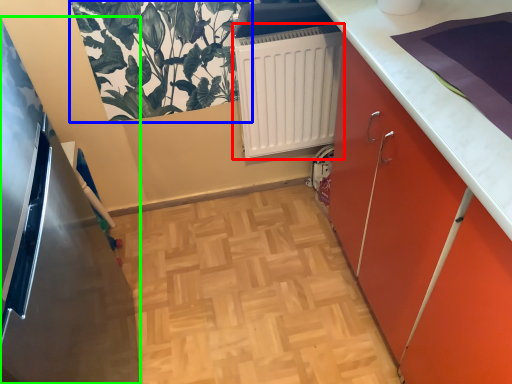
Question: Considering the real-world distances, which object is closest to radiator (highlighted by a red box)? plant (highlighted by a blue box) or appliance (highlighted by a green box).

Choices:
 (A) plant
 (B) appliance

Answer: (A)